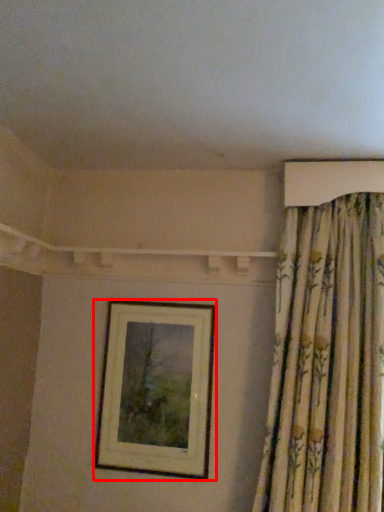
Question: Where is picture frame (annotated by the red box) located in relation to curtain in the image?

Choices:
 (A) left
 (B) right

Answer: (A)